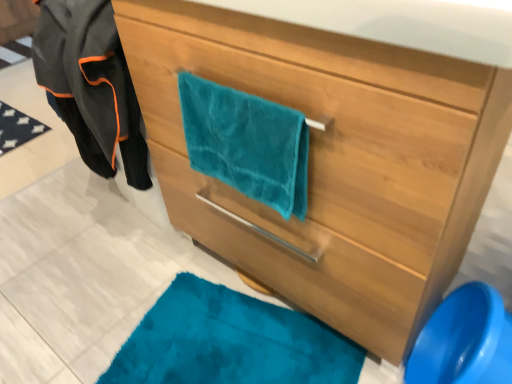
Question: Visually, is teal fabric at lower right positioned to the left or to the right of teal fabric towel at center?

Choices:
 (A) right
 (B) left

Answer: (A)

Question: Which is correct: teal fabric at lower right is inside teal fabric towel at center, or outside of it?

Choices:
 (A) outside
 (B) inside

Answer: (A)

Question: Which is nearer to the velvet black jacket at left?

Choices:
 (A) teal plush towel at center
 (B) teal fabric at lower right
 (C) teal fabric towel at center

Answer: (C)

Question: Considering the real-world distances, which object is closest to the teal fabric towel at center?

Choices:
 (A) velvet black jacket at left
 (B) teal plush towel at center
 (C) teal fabric at lower right

Answer: (B)